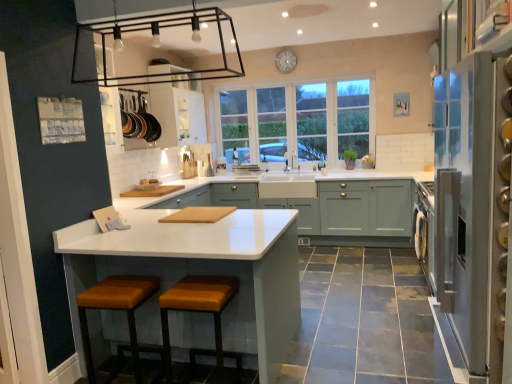
Question: Is white glossy cabinet at upper center, which is the second cabinetry in right-to-left order, spatially inside clear glass refrigerator at right, or outside of it?

Choices:
 (A) inside
 (B) outside

Answer: (B)

Question: Considering the positions of white glossy cabinet at upper center, marked as the first cabinetry in a left-to-right arrangement, and clear glass refrigerator at right in the image, is white glossy cabinet at upper center, marked as the first cabinetry in a left-to-right arrangement, bigger or smaller than clear glass refrigerator at right?

Choices:
 (A) small
 (B) big

Answer: (A)

Question: Estimate the real-world distances between objects in this image. Which object is farther from the orange fabric stool at lower center, the 1th step stool in the right-to-left sequence?

Choices:
 (A) clear glass refrigerator at right
 (B) leather-like brown stool at lower center, arranged as the 2th step stool when viewed from the right
 (C) white matte clock at upper center
 (D) white glossy cabinet at upper center, marked as the 1th cabinetry in a top-to-bottom arrangement
 (E) white glossy countertop at center

Answer: (C)

Question: Based on their relative distances, which object is nearer to the white glossy cabinet at upper center, the 2th cabinetry from the bottom?

Choices:
 (A) orange fabric stool at lower center, the 1th step stool in the right-to-left sequence
 (B) white glossy countertop at center
 (C) white glass window at center
 (D) clear glass refrigerator at right
 (E) leather-like brown stool at lower center, arranged as the 2th step stool when viewed from the right

Answer: (C)